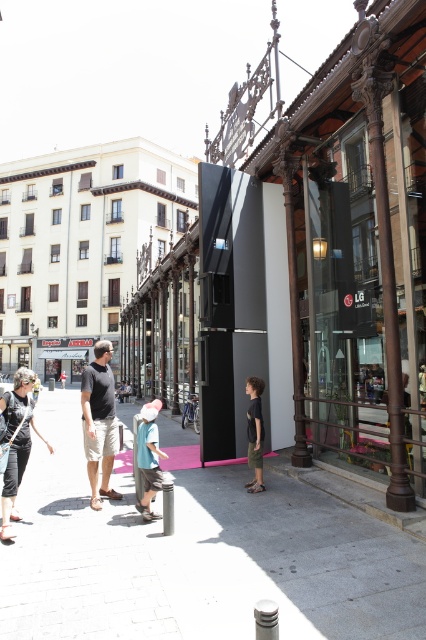
Question: Is light brown shorts at center wider than dark green shorts at center?

Choices:
 (A) yes
 (B) no

Answer: (A)

Question: Which point appears farthest from the camera in this image?

Choices:
 (A) (104, 349)
 (B) (26, 372)
 (C) (252, 419)
 (D) (120, 589)

Answer: (C)

Question: Which point is farther to the camera?

Choices:
 (A) light brown shorts at center
 (B) matte black jacket at lower left

Answer: (A)

Question: From the image, what is the correct spatial relationship of pink fabric hat at center in relation to dark green shorts at center?

Choices:
 (A) below
 (B) above

Answer: (B)

Question: In this image, where is pink rubber mat at center located relative to matte black jacket at lower left?

Choices:
 (A) below
 (B) above

Answer: (B)

Question: Which object is the farthest from the pink rubber mat at center?

Choices:
 (A) matte black jacket at lower left
 (B) dark green shorts at center

Answer: (A)